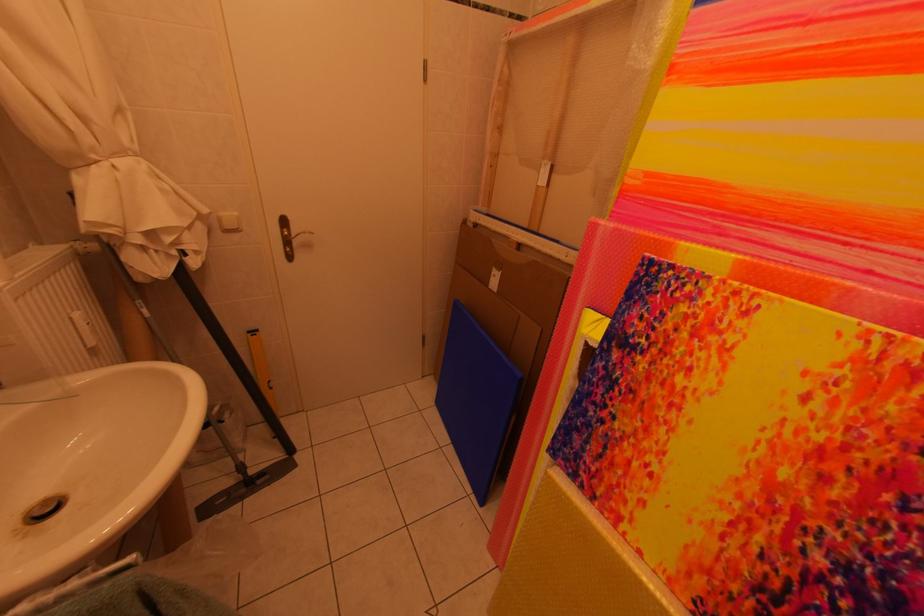
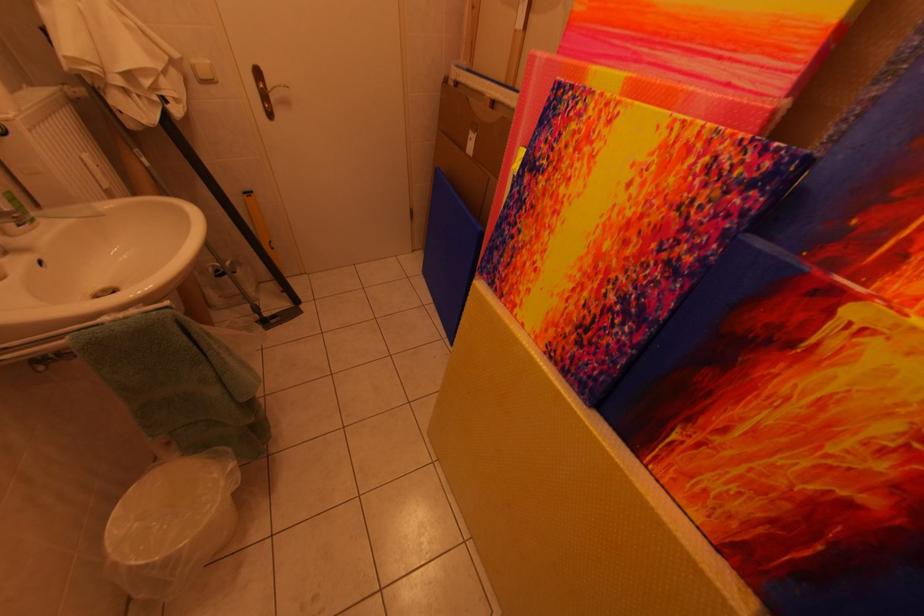
Where in the second image is the point corresponding to [675,365] from the first image?

(565, 180)